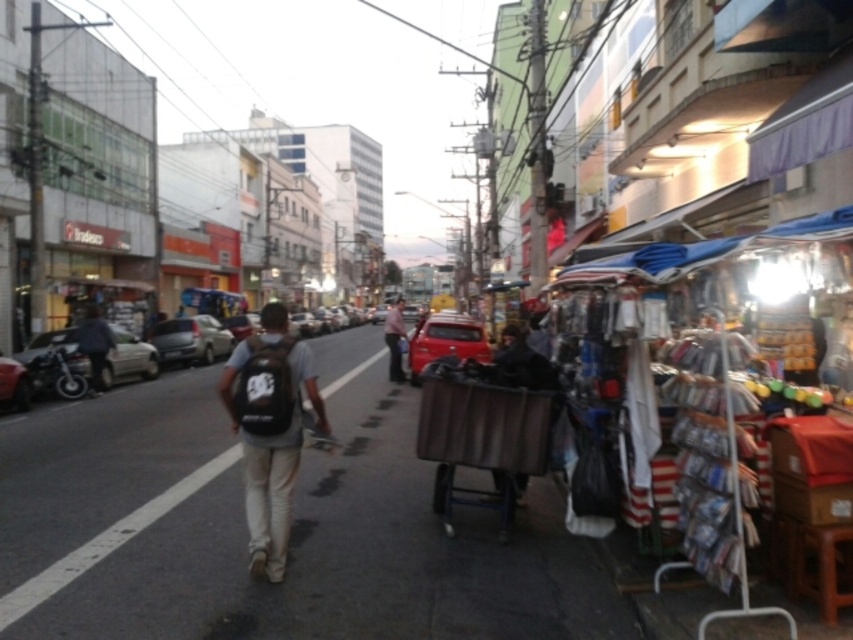
What do you see at coordinates (270, 429) in the screenshot? I see `black matte backpack at center` at bounding box center [270, 429].

Is black matte backpack at center thinner than light brown leather jacket at center?

No, black matte backpack at center is not thinner than light brown leather jacket at center.

At what (x,y) coordinates should I click in order to perform the action: click on black matte backpack at center. Please return your answer as a coordinate pair (x, y). Looking at the image, I should click on (270, 429).

You are a GUI agent. You are given a task and a screenshot of the screen. Output one action in this format:
    pyautogui.click(x=<x>, y=<y>)
    Task: Click on the black matte backpack at center
    The image size is (853, 640).
    Given the screenshot: What is the action you would take?
    pyautogui.click(x=270, y=429)

From the picture: Which is above, brown fabric cart at right or light brown leather jacket at center?

light brown leather jacket at center is above.

Image resolution: width=853 pixels, height=640 pixels. Find the location of `brown fabric cart at right`. brown fabric cart at right is located at coordinates (482, 440).

What do you see at coordinates (482, 440) in the screenshot?
I see `brown fabric cart at right` at bounding box center [482, 440].

At what (x,y) coordinates should I click in order to perform the action: click on brown fabric cart at right. Please return your answer as a coordinate pair (x, y). This screenshot has height=640, width=853. Looking at the image, I should click on (482, 440).

Identify the location of black matte backpack at center. This screenshot has width=853, height=640. (270, 429).

Between point (287, 422) and point (529, 413), which one is positioned behind?

Positioned behind is point (529, 413).

Who is more forward, (277, 490) or (430, 410)?

Point (277, 490) is in front.

Where is `black matte backpack at center`? Image resolution: width=853 pixels, height=640 pixels. black matte backpack at center is located at coordinates (270, 429).